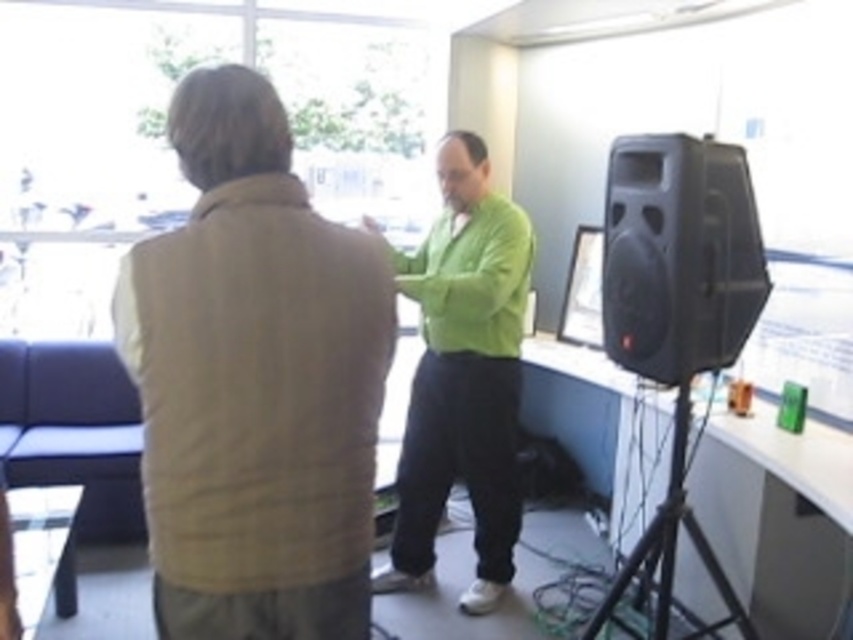
You are a delivery person who needs to place a small package between the green matte sweater at center and the black matte speaker at right. Can you fit the package if it measures 25 inches in length?

The green matte sweater at center is 25.33 inches away from the black matte speaker at right. Since the package is 25 inches long, it can fit between them as the distance is slightly larger than the package length.

You are trying to place a new plant pot between the green matte sweater at center and the black matte speaker at right. Based on their widths, can you determine if there will be enough space between them to fit the plant pot?

The green matte sweater at center might be wider than the black matte speaker at right, so there may not be enough space between them to fit the plant pot.

You are a delivery person who needs to place a small package between the beige woolen vest at upper left and the matte black speaker at right. Can you fit it there?

The beige woolen vest at upper left is to the left of the matte black speaker at right, so there is space between them to place the small package.